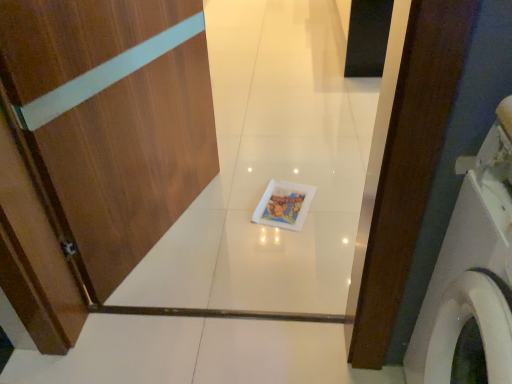
Question: Is the surface of wooden door at center in direct contact with white glossy washing machine at right?

Choices:
 (A) no
 (B) yes

Answer: (A)

Question: Is wooden door at center facing away from white glossy washing machine at right?

Choices:
 (A) no
 (B) yes

Answer: (A)

Question: Is wooden door at center to the left of white glossy washing machine at right from the viewer's perspective?

Choices:
 (A) yes
 (B) no

Answer: (A)

Question: Considering the relative sizes of wooden door at center and white glossy washing machine at right in the image provided, is wooden door at center thinner than white glossy washing machine at right?

Choices:
 (A) yes
 (B) no

Answer: (A)

Question: Does wooden door at center have a larger size compared to white glossy washing machine at right?

Choices:
 (A) yes
 (B) no

Answer: (B)

Question: Can you confirm if wooden door at center is wider than white glossy washing machine at right?

Choices:
 (A) no
 (B) yes

Answer: (A)

Question: From a real-world perspective, is white glossy washing machine at right below wooden door at center?

Choices:
 (A) yes
 (B) no

Answer: (A)

Question: Does white glossy washing machine at right appear on the right side of wooden door at center?

Choices:
 (A) no
 (B) yes

Answer: (B)

Question: Considering the relative sizes of white glossy washing machine at right and wooden door at center in the image provided, is white glossy washing machine at right thinner than wooden door at center?

Choices:
 (A) yes
 (B) no

Answer: (B)

Question: Is white glossy washing machine at right completely or partially outside of wooden door at center?

Choices:
 (A) yes
 (B) no

Answer: (A)

Question: Does white glossy washing machine at right have a smaller size compared to wooden door at center?

Choices:
 (A) no
 (B) yes

Answer: (A)

Question: Can you confirm if white glossy washing machine at right is wider than wooden door at center?

Choices:
 (A) no
 (B) yes

Answer: (B)

Question: From a real-world perspective, relative to wooden door at center, is white glossy washing machine at right vertically above or below?

Choices:
 (A) above
 (B) below

Answer: (B)